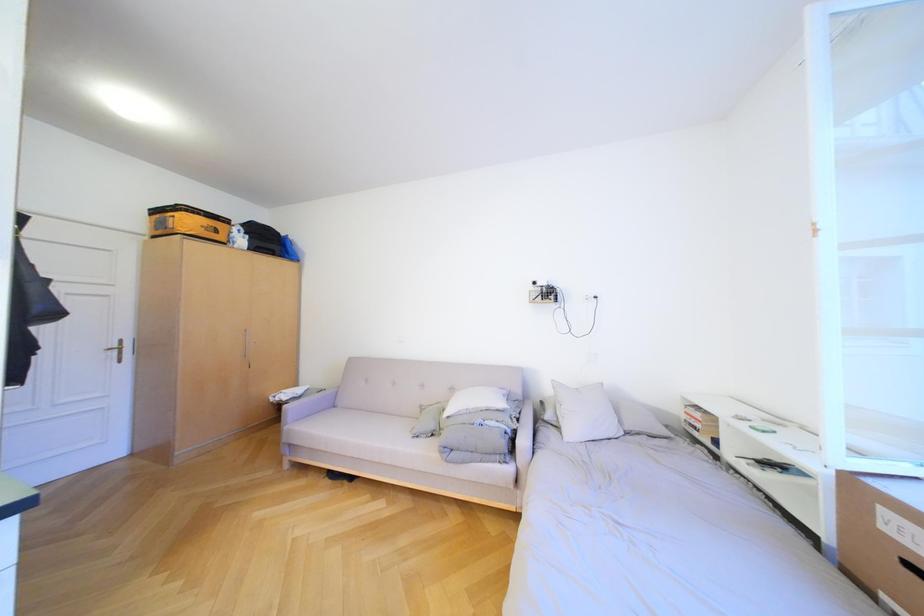
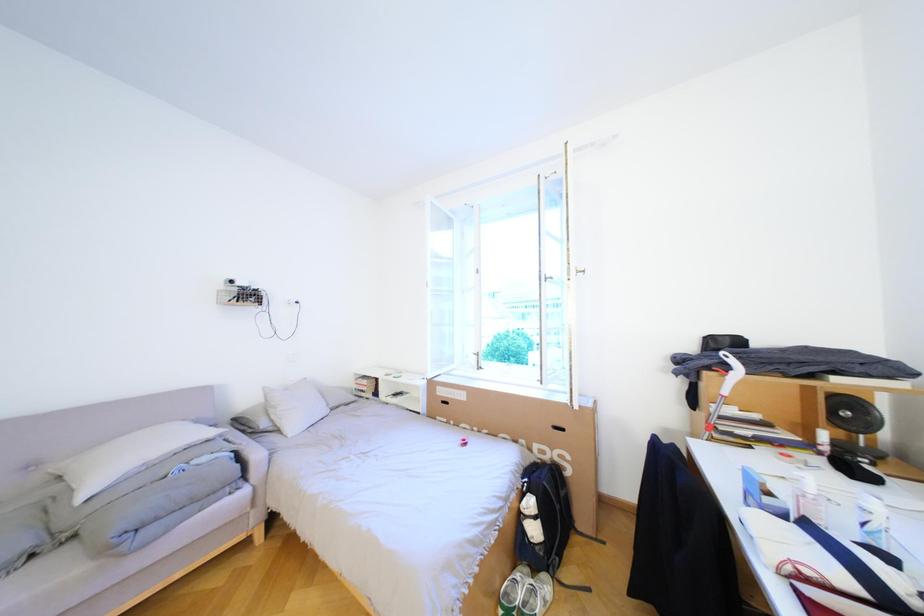
Question: The camera is either moving clockwise (left) or counter-clockwise (right) around the object. The first image is from the beginning of the video and the second image is from the end. Is the camera moving left or right when shooting the video?

Choices:
 (A) Left
 (B) Right

Answer: (A)